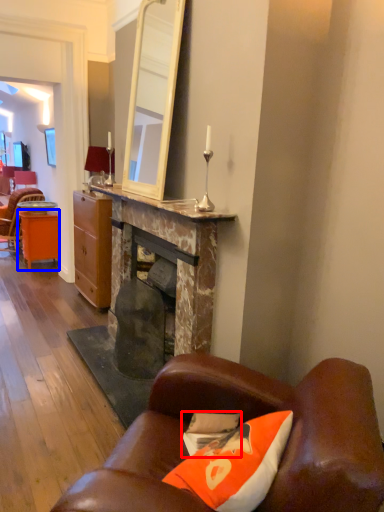
Question: Which of the following is the farthest to the observer, pillow (highlighted by a red box) or desk (highlighted by a blue box)?

Choices:
 (A) pillow
 (B) desk

Answer: (B)